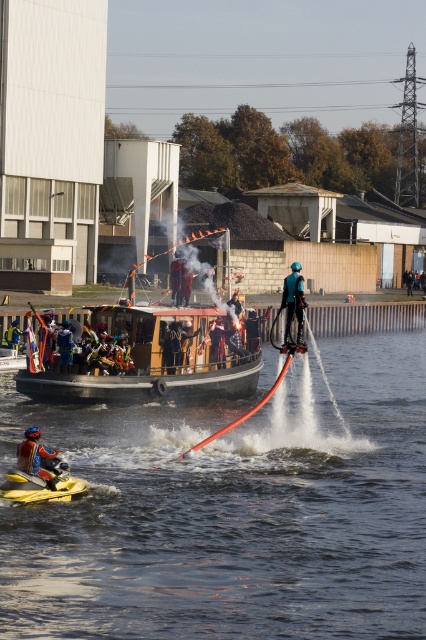
You are standing at the point marked as point (232, 512). What do you see directly in front of you?

At point (232, 512), there is clear water at jet ski right directly in front of you.

You are a drone operator trying to capture the best aerial shot of the two points in the scene. The first point is labeled as point (34, 444) and the second as point (282, 300). Based on their positions, which point should you focus on first to ensure it appears closer to the camera in the final shot?

Point (34, 444) should be focused on first because it is positioned in front of point (282, 300), making it closer to the camera.